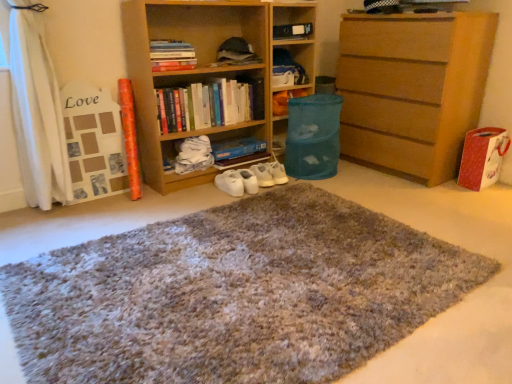
Identify the location of free space on the front side of white matte sneakers at center. The height and width of the screenshot is (384, 512). [x=241, y=201].